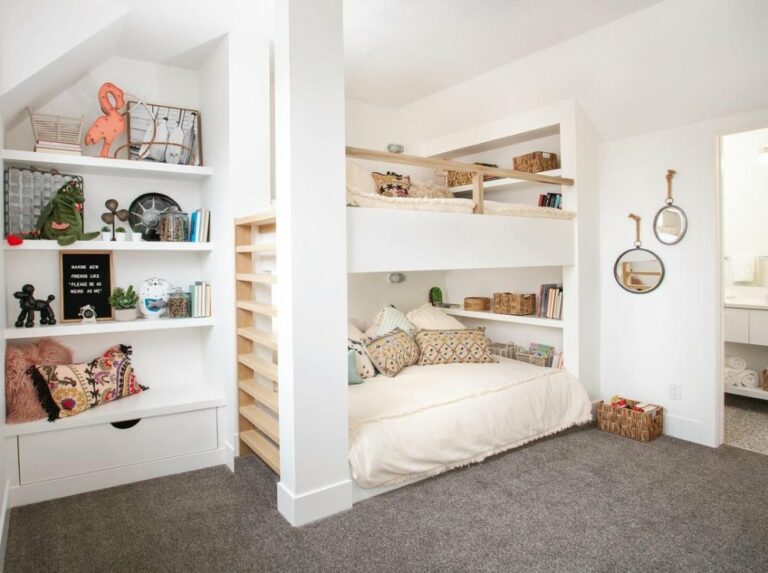
Locate an element on the screen. The image size is (768, 573). white shelf is located at coordinates (184, 364).